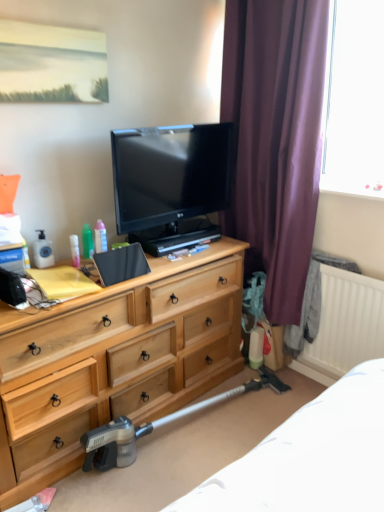
Question: Considering the relative positions of green plastic bottle at upper left, the second toiletry from the right, and purple velvet curtain at right in the image provided, is green plastic bottle at upper left, the second toiletry from the right, to the left of purple velvet curtain at right from the viewer's perspective?

Choices:
 (A) yes
 (B) no

Answer: (A)

Question: Is green plastic bottle at upper left, the second toiletry from the right, taller than purple velvet curtain at right?

Choices:
 (A) yes
 (B) no

Answer: (B)

Question: Is green plastic bottle at upper left, the second toiletry from the right, turned away from purple velvet curtain at right?

Choices:
 (A) yes
 (B) no

Answer: (B)

Question: Is green plastic bottle at upper left, the second toiletry positioned from the left, facing towards purple velvet curtain at right?

Choices:
 (A) yes
 (B) no

Answer: (B)

Question: From a real-world perspective, is green plastic bottle at upper left, the second toiletry from the right, on purple velvet curtain at right?

Choices:
 (A) no
 (B) yes

Answer: (A)

Question: Is green plastic bottle at upper left, the second toiletry from the right, further to the viewer compared to purple velvet curtain at right?

Choices:
 (A) no
 (B) yes

Answer: (B)

Question: From a real-world perspective, is metallic gray vacuum cleaner at lower center under matte black tv at center?

Choices:
 (A) no
 (B) yes

Answer: (B)

Question: Considering the relative sizes of metallic gray vacuum cleaner at lower center and matte black tv at center in the image provided, is metallic gray vacuum cleaner at lower center taller than matte black tv at center?

Choices:
 (A) yes
 (B) no

Answer: (B)

Question: Does metallic gray vacuum cleaner at lower center touch matte black tv at center?

Choices:
 (A) yes
 (B) no

Answer: (B)

Question: Is metallic gray vacuum cleaner at lower center wider than matte black tv at center?

Choices:
 (A) no
 (B) yes

Answer: (B)

Question: Is metallic gray vacuum cleaner at lower center far away from matte black tv at center?

Choices:
 (A) no
 (B) yes

Answer: (B)

Question: Does metallic gray vacuum cleaner at lower center have a smaller size compared to matte black tv at center?

Choices:
 (A) yes
 (B) no

Answer: (B)

Question: Is matte black tv at center oriented away from translucent plastic spray bottle at center-left, the 3th toiletry when ordered from left to right?

Choices:
 (A) yes
 (B) no

Answer: (B)